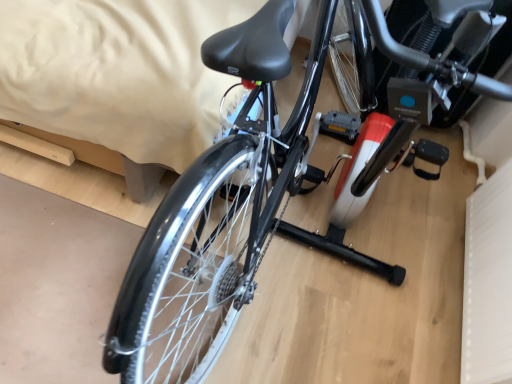
This screenshot has width=512, height=384. What do you see at coordinates (116, 79) in the screenshot?
I see `beige fabric mattress at upper left` at bounding box center [116, 79].

The image size is (512, 384). I want to click on beige fabric mattress at upper left, so click(116, 79).

The image size is (512, 384). Find the location of `beige fabric mattress at upper left`. beige fabric mattress at upper left is located at coordinates pyautogui.click(x=116, y=79).